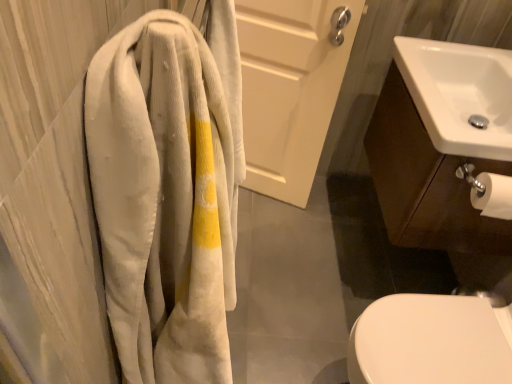
Question: Is white glossy sink at right further to camera compared to white glossy sink at upper right?

Choices:
 (A) no
 (B) yes

Answer: (B)

Question: Can you confirm if white glossy sink at right is positioned to the left of white glossy sink at upper right?

Choices:
 (A) yes
 (B) no

Answer: (A)

Question: Is white glossy sink at right shorter than white glossy sink at upper right?

Choices:
 (A) yes
 (B) no

Answer: (B)

Question: Is white glossy sink at right not within white glossy sink at upper right?

Choices:
 (A) no
 (B) yes

Answer: (B)

Question: From a real-world perspective, is white glossy sink at right beneath white glossy sink at upper right?

Choices:
 (A) no
 (B) yes

Answer: (B)

Question: Does white glossy sink at right have a smaller size compared to white glossy sink at upper right?

Choices:
 (A) yes
 (B) no

Answer: (B)

Question: From a real-world perspective, is white glossy sink at upper right positioned over corduroy towel at left based on gravity?

Choices:
 (A) no
 (B) yes

Answer: (A)

Question: Is white glossy sink at upper right outside of corduroy towel at left?

Choices:
 (A) yes
 (B) no

Answer: (A)

Question: Is white glossy sink at upper right at the left side of corduroy towel at left?

Choices:
 (A) yes
 (B) no

Answer: (B)

Question: Does white glossy sink at upper right come behind corduroy towel at left?

Choices:
 (A) yes
 (B) no

Answer: (A)

Question: Is white glossy sink at upper right far from corduroy towel at left?

Choices:
 (A) yes
 (B) no

Answer: (B)

Question: From the image's perspective, is white glossy sink at upper right on corduroy towel at left?

Choices:
 (A) no
 (B) yes

Answer: (B)

Question: Does white matte door at upper center have a smaller size compared to white glossy sink at right?

Choices:
 (A) yes
 (B) no

Answer: (A)